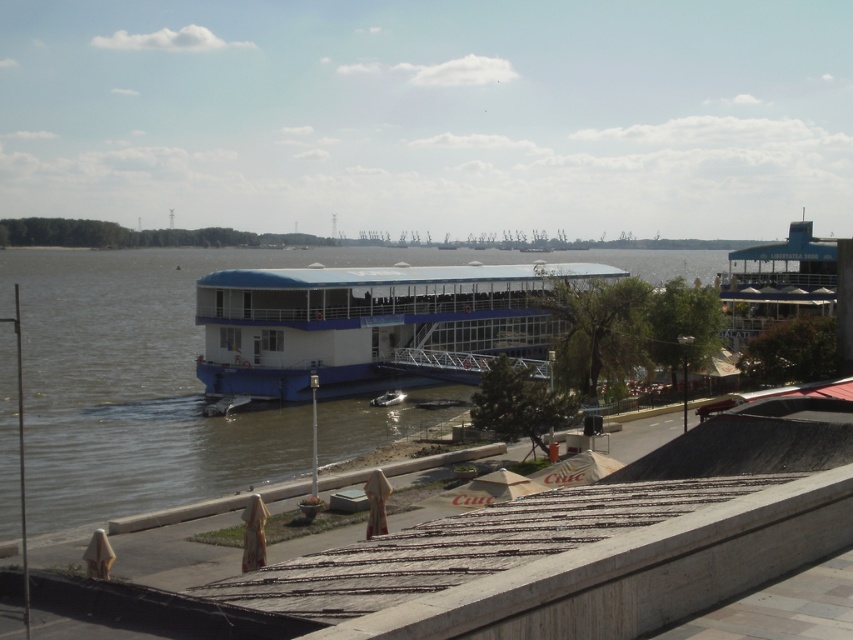
Question: Which point appears closest to the camera in this image?

Choices:
 (A) (283, 269)
 (B) (381, 394)

Answer: (B)

Question: Considering the relative positions of white glossy boat at center and metallic silver boat at center in the image provided, where is white glossy boat at center located with respect to metallic silver boat at center?

Choices:
 (A) above
 (B) below

Answer: (A)

Question: Does white glossy boat at center appear under metallic silver boat at center?

Choices:
 (A) yes
 (B) no

Answer: (B)

Question: Is white glossy boat at center to the right of metallic silver boat at center from the viewer's perspective?

Choices:
 (A) no
 (B) yes

Answer: (B)